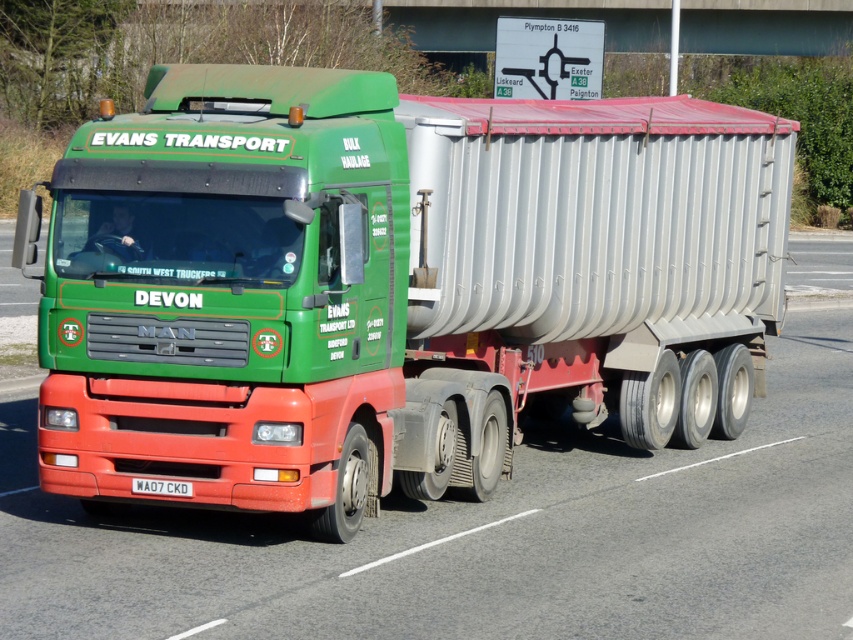
Question: Does green matte truck at center come behind white plastic license plate at center?

Choices:
 (A) yes
 (B) no

Answer: (B)

Question: Considering the relative positions of green matte truck at center and white plastic license plate at center in the image provided, where is green matte truck at center located with respect to white plastic license plate at center?

Choices:
 (A) right
 (B) left

Answer: (A)

Question: Which object appears farthest from the camera in this image?

Choices:
 (A) white plastic license plate at center
 (B) green matte truck at center

Answer: (A)

Question: From the image, what is the correct spatial relationship of green matte truck at center in relation to white plastic license plate at center?

Choices:
 (A) below
 (B) above

Answer: (B)